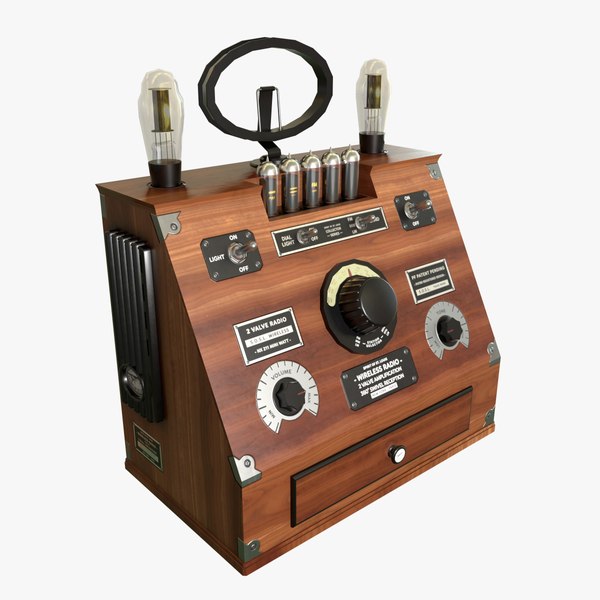
Point to the what you use to open a drawer in the image. Your answer should be formatted as a list of tuples, i.e. [(x1, y1), (x2, y2), ...], where each tuple contains the x and y coordinates of a point satisfying the conditions above.

[(399, 452)]